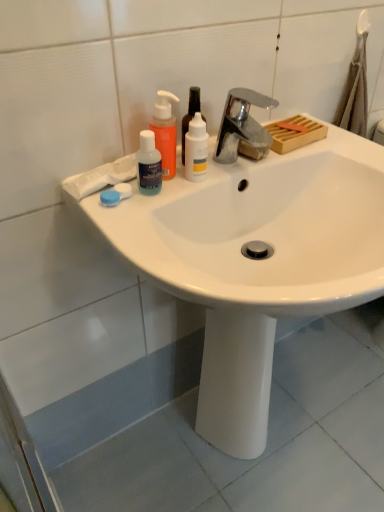
Find the location of `vacant area that is situated to the right of white glossy bottle at center, the second mouthwash when ordered from right to left`. vacant area that is situated to the right of white glossy bottle at center, the second mouthwash when ordered from right to left is located at coordinates [x=254, y=163].